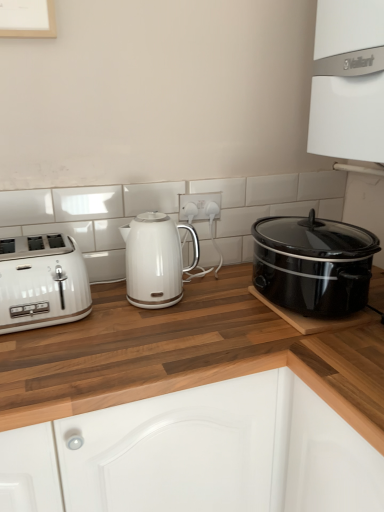
I want to click on vacant area that is in front of white glossy toaster at left, so click(46, 348).